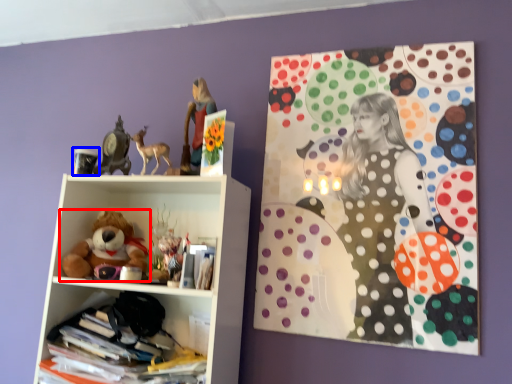
Question: Among these objects, which one is farthest to the camera, teddy bear (highlighted by a red box) or toy (highlighted by a blue box)?

Choices:
 (A) teddy bear
 (B) toy

Answer: (B)